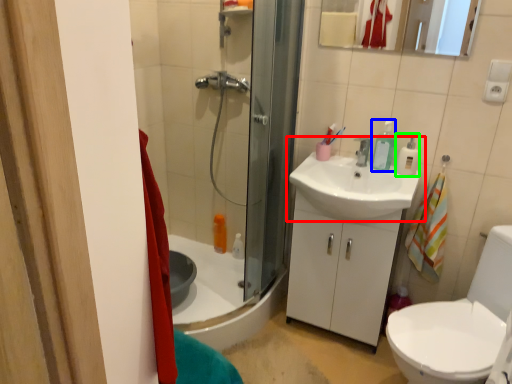
Question: Based on their relative distances, which object is farther from sink (highlighted by a red box)? Choose from toiletry (highlighted by a blue box) and soap dispenser (highlighted by a green box).

Choices:
 (A) toiletry
 (B) soap dispenser

Answer: (B)